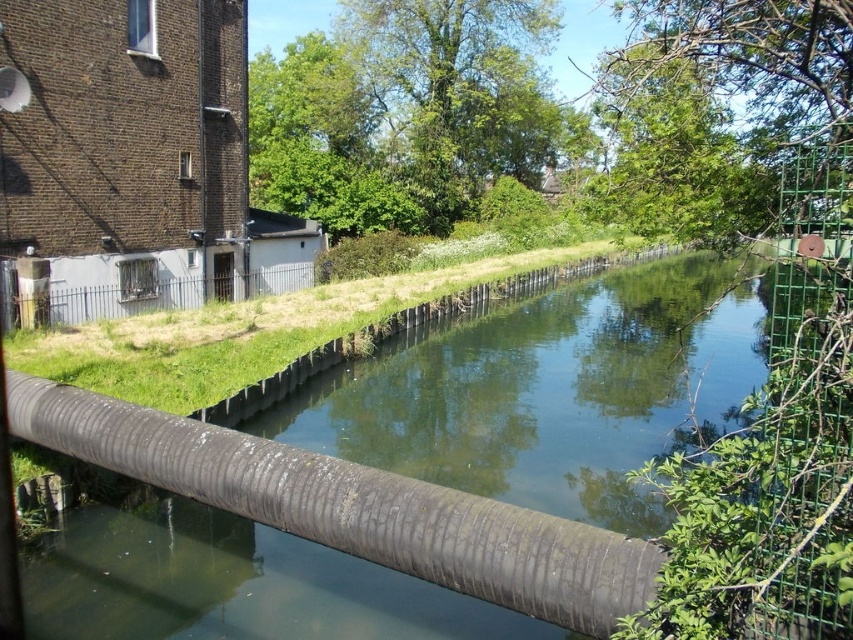
Between greenish-gray concrete canal at center and gray metal fence at center-left, which one appears on the right side from the viewer's perspective?

Positioned to the right is greenish-gray concrete canal at center.

Can you confirm if greenish-gray concrete canal at center is bigger than gray metal fence at center-left?

Correct, greenish-gray concrete canal at center is larger in size than gray metal fence at center-left.

The height and width of the screenshot is (640, 853). Identify the location of greenish-gray concrete canal at center. (387, 490).